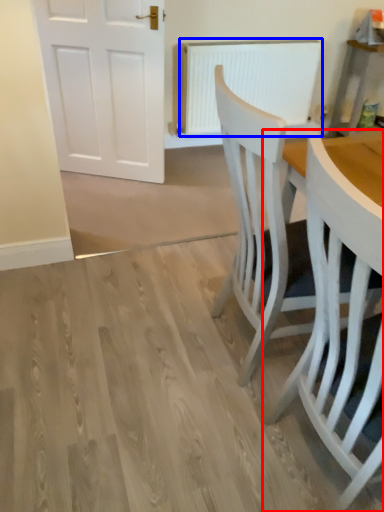
Question: Among these objects, which one is nearest to the camera, chair (highlighted by a red box) or radiator (highlighted by a blue box)?

Choices:
 (A) chair
 (B) radiator

Answer: (A)